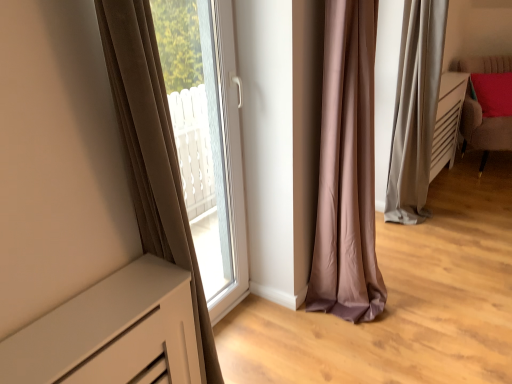
Identify the location of vacant area situated below velvet red cushion at right (from a real-world perspective). This screenshot has width=512, height=384. point(482,166).